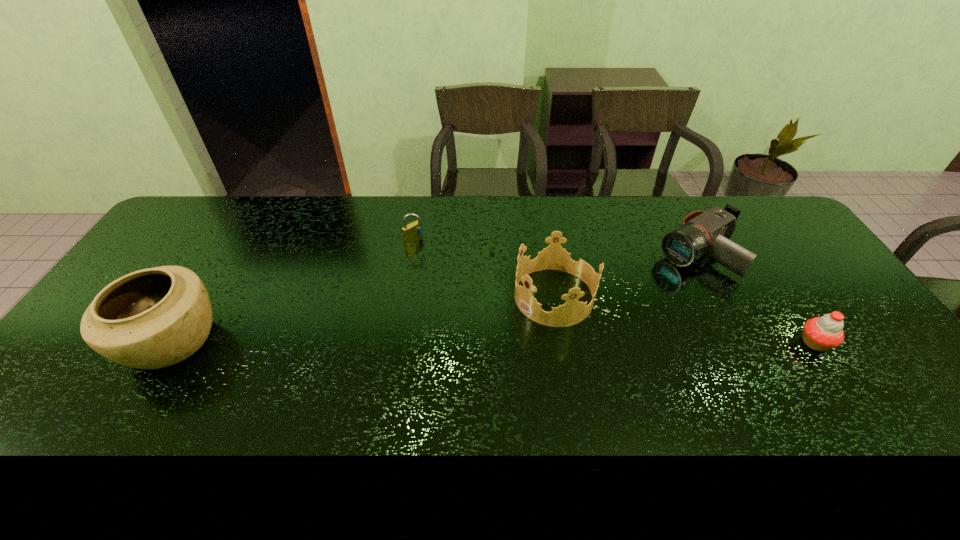
Find the location of a particular element. This screenshot has width=960, height=540. free location that satisfies the following two spatial constraints: 1. on the front side of the cupcake; 2. on the right side of the tallest object is located at coordinates (171, 343).

You are a GUI agent. You are given a task and a screenshot of the screen. Output one action in this format:
    pyautogui.click(x=<x>, y=<y>)
    Task: Click on the vacant space that satisfies the following two spatial constraints: 1. on the back side of the fourth shortest object; 2. on the left side of the camcorder
    
    Given the screenshot: What is the action you would take?
    pyautogui.click(x=546, y=252)